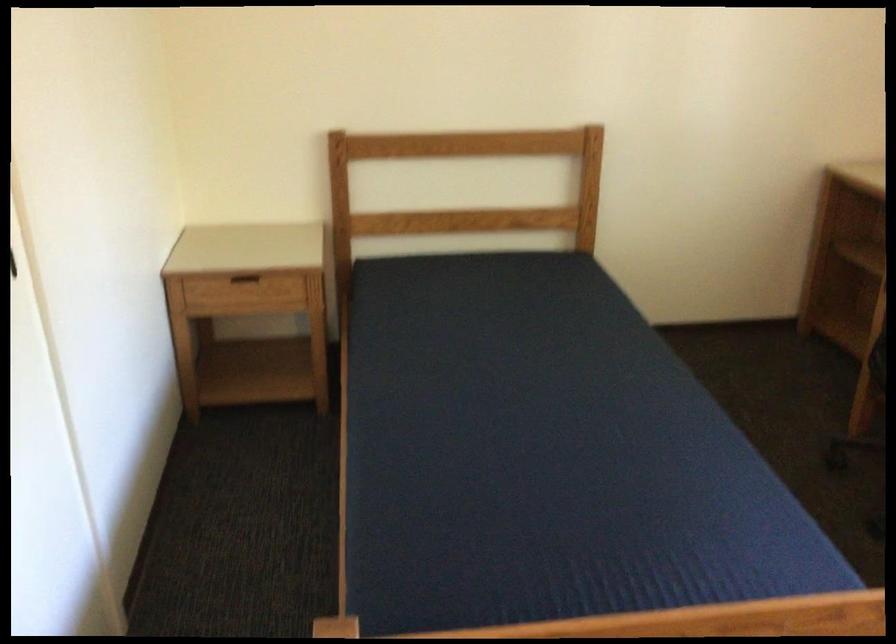
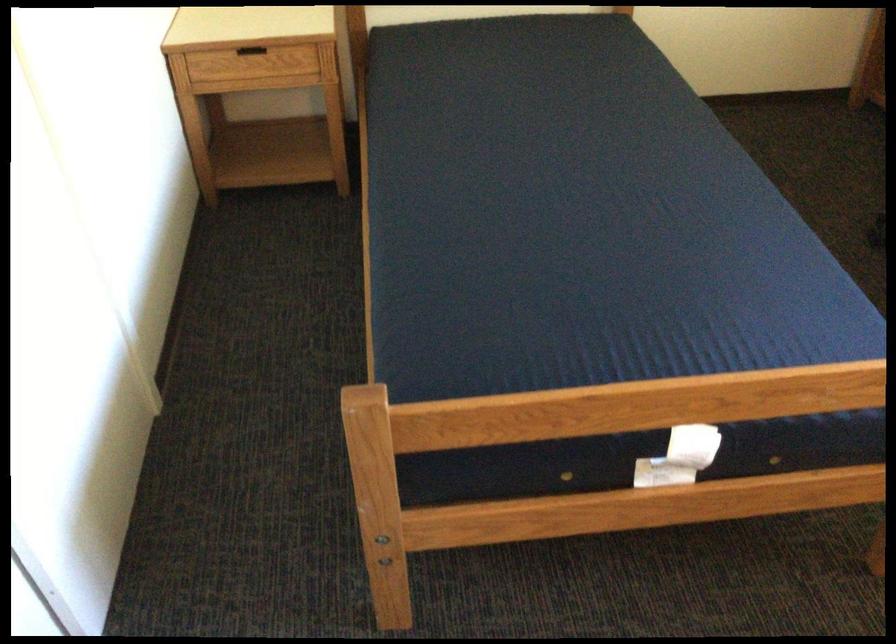
Where in the second image is the point corresponding to point 359,363 from the first image?

(378, 140)